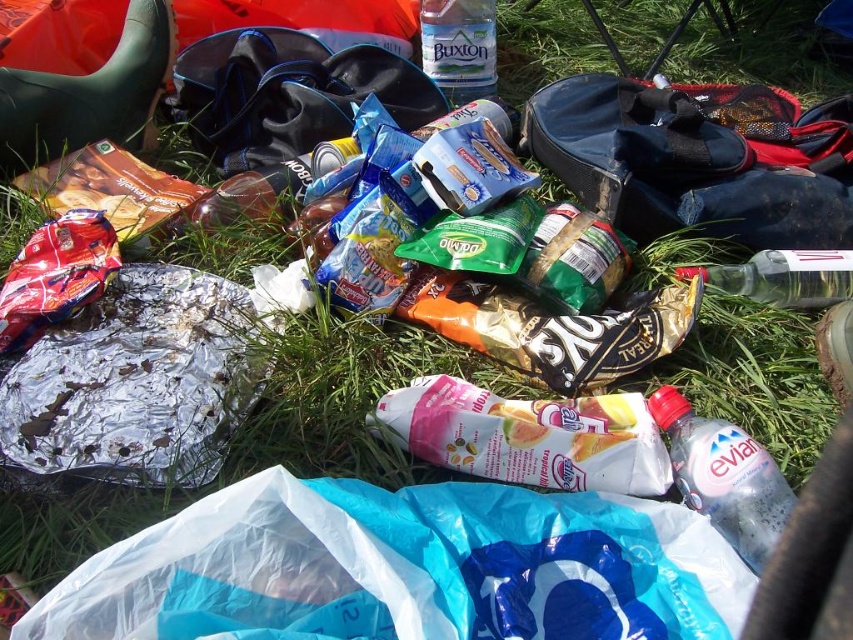
Is clear plastic bottle at lower right further to the viewer compared to clear plastic bottle at center-right?

That is False.

Who is positioned more to the right, clear plastic bottle at lower right or clear plastic bottle at center-right?

From the viewer's perspective, clear plastic bottle at center-right appears more on the right side.

Which is behind, point (733, 468) or point (735, 291)?

Positioned behind is point (735, 291).

Where is `clear plastic bottle at lower right`? clear plastic bottle at lower right is located at coordinates pyautogui.click(x=724, y=476).

Is point (630, 490) closer to camera compared to point (454, 102)?

Yes.

Which of these two, white matte snack packet at center or clear plastic bottle at center, stands taller?

Standing taller between the two is clear plastic bottle at center.

This screenshot has width=853, height=640. I want to click on white matte snack packet at center, so click(527, 436).

Does point (381, 548) lie in front of point (688, 483)?

Yes, point (381, 548) is in front of point (688, 483).

Based on the photo, does blue plastic bag at lower center have a lesser height compared to clear plastic bottle at lower right?

Indeed, blue plastic bag at lower center has a lesser height compared to clear plastic bottle at lower right.

Where is `blue plastic bag at lower center`? blue plastic bag at lower center is located at coordinates (404, 568).

I want to click on blue plastic bag at lower center, so click(x=404, y=568).